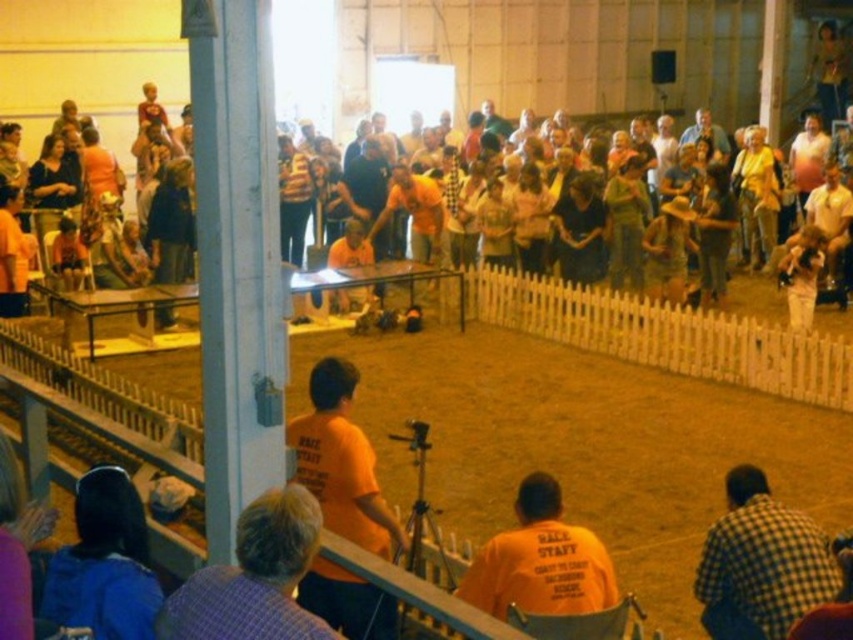
You are a participant in the livestock judging event and need to move from your current position at point (289, 211) to the judging booth located at point (299, 486). Is the path between these two points clear of any obstacles?

Yes, the path between point (299, 486) and point (289, 211) is clear since point (299, 486) is in front of point (289, 211), indicating no obstacles are blocking the way.

You are organizing a photo shoot and need to decide which background cloth to use. The blue fabric at lower left and the striped sweater at center are both available. Which one is wider?

The blue fabric at lower left is wider than the striped sweater at center.